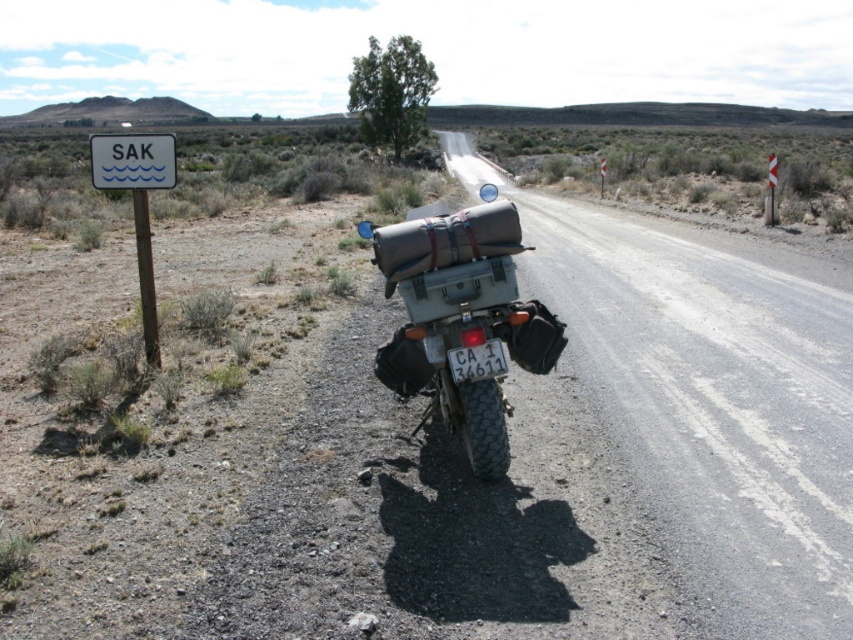
Question: Which point is farther to the camera?

Choices:
 (A) brown leather bag at rear
 (B) matte gray luggage at center
 (C) white plastic sign at left

Answer: (C)

Question: Which object appears farthest from the camera in this image?

Choices:
 (A) matte gray luggage at center
 (B) white plastic sign at left

Answer: (B)

Question: Can you confirm if white plastic sign at left is smaller than white plastic sign at upper left?

Choices:
 (A) no
 (B) yes

Answer: (A)

Question: Which of the following is the farthest from the observer?

Choices:
 (A) white plastic sign at left
 (B) brown leather bag at rear
 (C) white plastic sign at upper left
 (D) matte gray luggage at center

Answer: (A)

Question: Is matte gray luggage at center to the left of white plastic sign at left from the viewer's perspective?

Choices:
 (A) no
 (B) yes

Answer: (A)

Question: Can you confirm if white plastic sign at left is positioned to the right of white plastic sign at upper left?

Choices:
 (A) no
 (B) yes

Answer: (B)